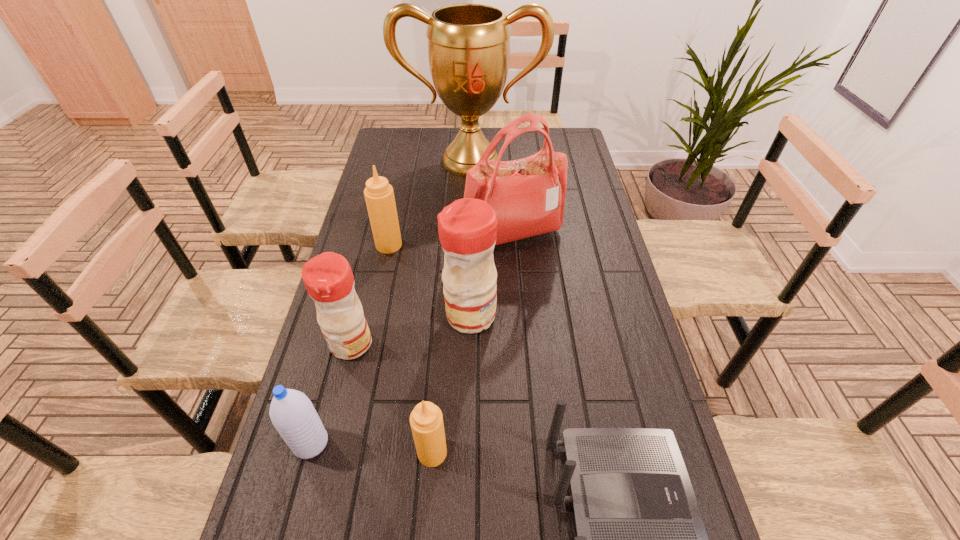
Locate an element on the screen. trophy cup that is positioned at the left edge is located at coordinates (468, 44).

I want to click on water bottle that is at the left edge, so click(292, 413).

Identify the location of object that is positioned at the right edge. Image resolution: width=960 pixels, height=540 pixels. (528, 195).

This screenshot has width=960, height=540. Find the location of `object present at the far left corner`. object present at the far left corner is located at coordinates (468, 44).

I want to click on free space at the far edge, so click(x=527, y=144).

Image resolution: width=960 pixels, height=540 pixels. In order to click on vacant space at the left edge in this screenshot , I will do `click(397, 183)`.

This screenshot has width=960, height=540. In order to click on free location at the right edge in this screenshot , I will do `click(571, 198)`.

This screenshot has height=540, width=960. In the image, there is a desktop. What are the coordinates of `vacant region at the far left corner` in the screenshot? It's located at (403, 147).

Locate an element on the screen. This screenshot has height=540, width=960. vacant area at the far right corner of the desktop is located at coordinates (581, 153).

This screenshot has width=960, height=540. Find the location of `free space between the farthest condiment and the trophy cup`. free space between the farthest condiment and the trophy cup is located at coordinates 430,203.